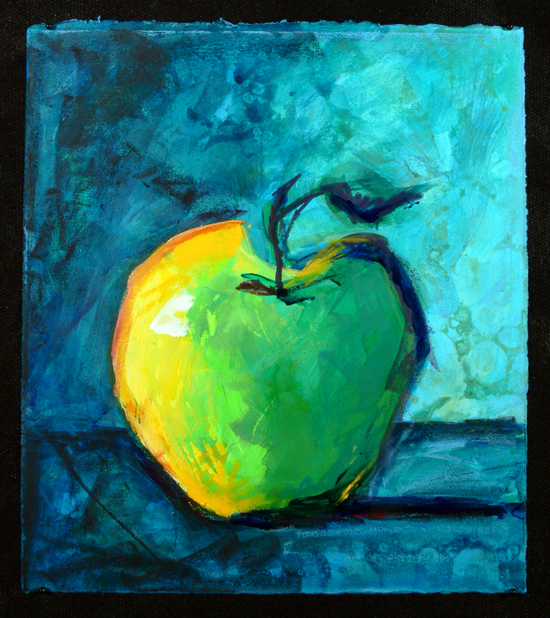
The image size is (550, 618). What are the coordinates of `corner` in the screenshot? It's located at (56, 593).